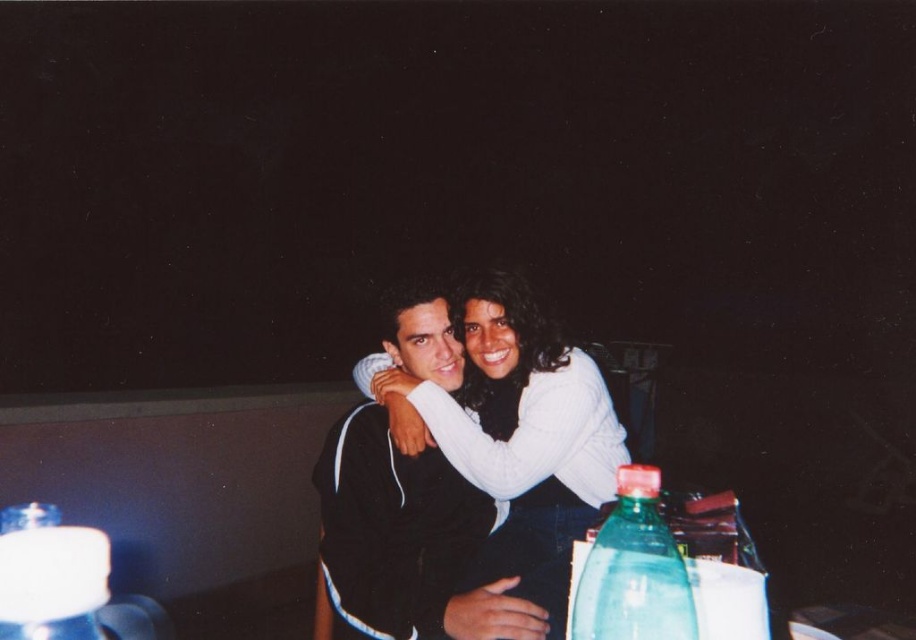
Question: Can you confirm if black matte jacket at center is wider than translucent plastic bottle at lower left?

Choices:
 (A) no
 (B) yes

Answer: (B)

Question: Which of the following is the farthest from the observer?

Choices:
 (A) (572, 600)
 (B) (465, 561)

Answer: (B)

Question: Which point appears farthest from the camera in this image?

Choices:
 (A) (64, 616)
 (B) (445, 476)
 (C) (645, 493)

Answer: (B)

Question: Is black matte jacket at center above translucent plastic bottle at lower right?

Choices:
 (A) yes
 (B) no

Answer: (B)

Question: Among these points, which one is farthest from the camera?

Choices:
 (A) (622, 570)
 (B) (73, 616)

Answer: (A)

Question: Can you confirm if translucent plastic bottle at lower right is bigger than translucent plastic bottle at lower left?

Choices:
 (A) no
 (B) yes

Answer: (B)